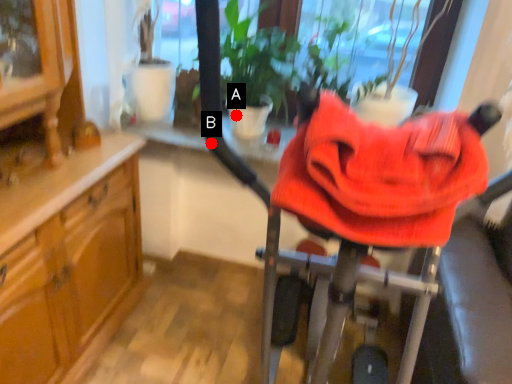
Question: Two points are circled on the image, labeled by A and B beside each circle. Which point is farther from the camera taking this photo?

Choices:
 (A) A is further
 (B) B is further

Answer: (A)